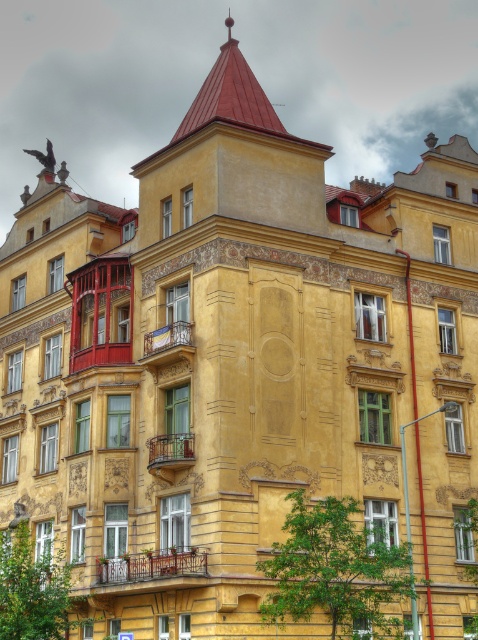
Is metallic wrought iron balcony at upper center wider than metallic wrought iron balcony at center?

Indeed, metallic wrought iron balcony at upper center has a greater width compared to metallic wrought iron balcony at center.

Who is taller, metallic wrought iron balcony at upper center or metallic wrought iron balcony at center?

Standing taller between the two is metallic wrought iron balcony at upper center.

Where is `metallic wrought iron balcony at upper center`? metallic wrought iron balcony at upper center is located at coordinates (166, 342).

Which of these two, rustic wooden balcony at lower center or metallic wrought iron balcony at upper center, stands taller?

metallic wrought iron balcony at upper center

This screenshot has width=478, height=640. I want to click on rustic wooden balcony at lower center, so click(x=152, y=564).

Where is `rustic wooden balcony at lower center`? This screenshot has height=640, width=478. rustic wooden balcony at lower center is located at coordinates pyautogui.click(x=152, y=564).

Which is behind, point (132, 564) or point (149, 440)?

The point (149, 440) is more distant.

Between point (171, 554) and point (150, 452), which one is positioned in front?

Point (171, 554) is in front.

What do you see at coordinates (152, 564) in the screenshot? This screenshot has width=478, height=640. I see `rustic wooden balcony at lower center` at bounding box center [152, 564].

You are a GUI agent. You are given a task and a screenshot of the screen. Output one action in this format:
    pyautogui.click(x=<x>, y=<y>)
    Task: Click on the rustic wooden balcony at lower center
    Image resolution: width=478 pixels, height=640 pixels.
    Given the screenshot: What is the action you would take?
    pyautogui.click(x=152, y=564)